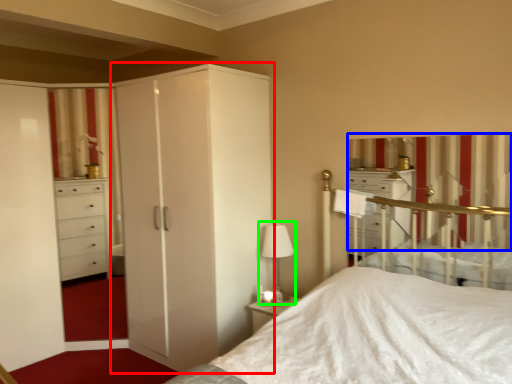
Question: Which is nearer to the cupboard (highlighted by a red box)? curtain (highlighted by a blue box) or table lamp (highlighted by a green box).

Choices:
 (A) curtain
 (B) table lamp

Answer: (B)